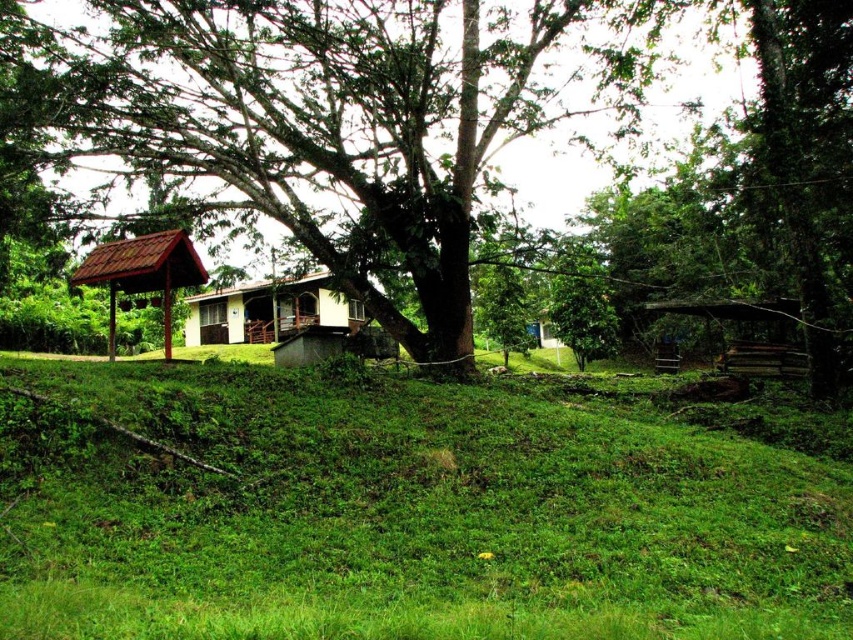
Question: Can you confirm if green rough bark tree at center is positioned below matte brown hut at left?

Choices:
 (A) no
 (B) yes

Answer: (A)

Question: Based on their relative distances, which object is farther from the green rough bark tree at center?

Choices:
 (A) matte brown hut at left
 (B) green grassy at center

Answer: (B)

Question: Is green grassy at center to the left of matte brown hut at left from the viewer's perspective?

Choices:
 (A) yes
 (B) no

Answer: (B)

Question: Is green rough bark tree at center below white matte house at center?

Choices:
 (A) yes
 (B) no

Answer: (B)

Question: Which point is farther from the camera taking this photo?

Choices:
 (A) (106, 269)
 (B) (163, 52)
 (C) (846, 548)

Answer: (B)

Question: Which of the following is the closest to the observer?

Choices:
 (A) (438, 100)
 (B) (209, 294)
 (C) (280, 387)
 (D) (120, 275)

Answer: (C)